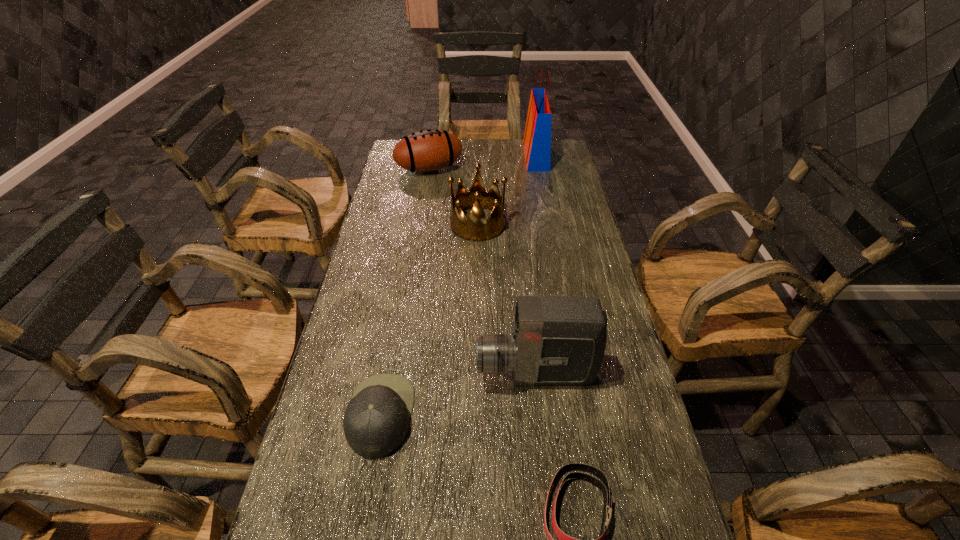
Where is `free space located 0.190m at the front of the fifth shortest object, highlighting the lens`? The image size is (960, 540). free space located 0.190m at the front of the fifth shortest object, highlighting the lens is located at coordinates (402, 375).

At what (x,y) coordinates should I click in order to perform the action: click on vacant area situated 0.340m at the front of the fifth shortest object, highlighting the lens. Please return your answer as a coordinate pair (x, y). The width and height of the screenshot is (960, 540). Looking at the image, I should click on (343, 375).

Identify the location of vacant space situated 0.360m on the front of the fourth nearest object. The width and height of the screenshot is (960, 540). (477, 324).

Where is `free space located on the front of the fourth tallest object`? This screenshot has width=960, height=540. free space located on the front of the fourth tallest object is located at coordinates (418, 245).

The width and height of the screenshot is (960, 540). Identify the location of blank space located on the brim of the second shortest object. (570, 415).

You are a GUI agent. You are given a task and a screenshot of the screen. Output one action in this format:
    pyautogui.click(x=<x>, y=<y>)
    Task: Click on the shopping bag located in the far edge section of the desktop
    The width and height of the screenshot is (960, 540).
    Given the screenshot: What is the action you would take?
    pyautogui.click(x=537, y=138)

You are a GUI agent. You are given a task and a screenshot of the screen. Output one action in this format:
    pyautogui.click(x=<x>, y=<y>)
    Task: Click on the football (American) located at the far edge
    The image size is (960, 540).
    Given the screenshot: What is the action you would take?
    pyautogui.click(x=431, y=150)

What are the coordinates of `football (American) that is at the left edge` in the screenshot? It's located at (431, 150).

The height and width of the screenshot is (540, 960). Identify the location of cap that is at the left edge. (376, 421).

Find the location of a particular element. shopping bag located at the right edge is located at coordinates (537, 138).